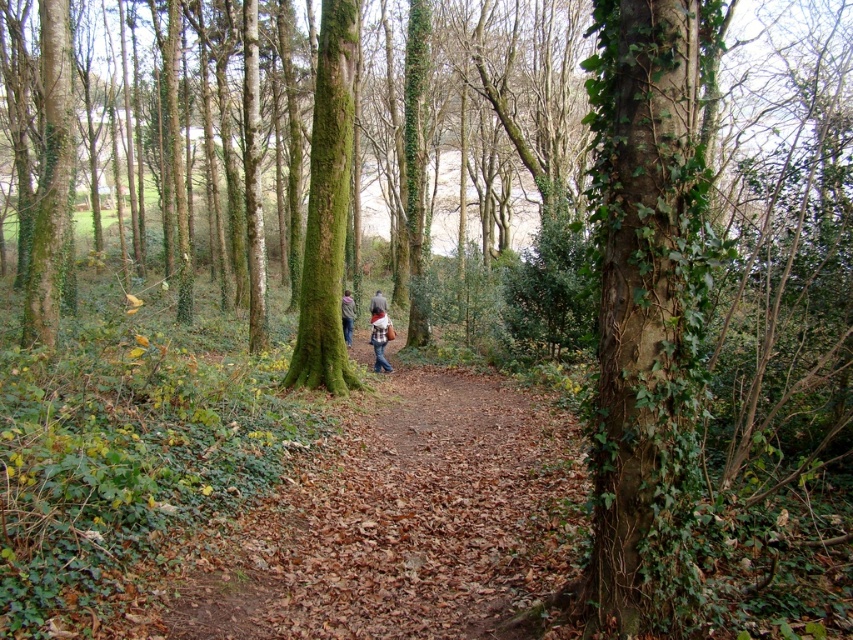
Question: Considering the real-world distances, which object is closest to the brown leather jacket at center?

Choices:
 (A) dark brown leather jacket at center
 (B) denim jacket at center

Answer: (B)

Question: Can you confirm if denim jacket at center is positioned to the right of brown leather jacket at center?

Choices:
 (A) no
 (B) yes

Answer: (B)

Question: Which of the following is the farthest from the observer?

Choices:
 (A) dark brown leather jacket at center
 (B) denim jacket at center
 (C) green mossy tree at center
 (D) brown leather jacket at center

Answer: (A)

Question: Can you confirm if green mossy tree at center is bigger than denim jacket at center?

Choices:
 (A) no
 (B) yes

Answer: (A)

Question: Which point is closer to the camera taking this photo?

Choices:
 (A) (334, 147)
 (B) (344, 333)
 (C) (387, 339)
 (D) (379, 300)

Answer: (A)

Question: From the image, what is the correct spatial relationship of green mossy tree at center in relation to brown leather jacket at center?

Choices:
 (A) left
 (B) right

Answer: (B)